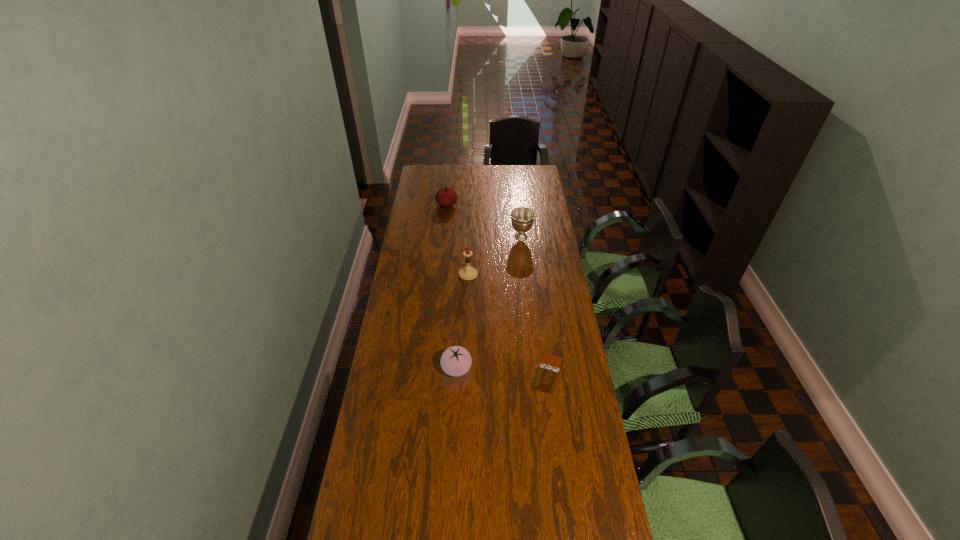
Locate an element on the screen. free space located 0.200m on the front of the chocolate bar is located at coordinates (558, 451).

Find the location of `object that is at the left edge`. object that is at the left edge is located at coordinates (446, 197).

This screenshot has width=960, height=540. In order to click on chalice that is at the right edge in this screenshot , I will do `click(522, 218)`.

What are the coordinates of `chocolate bar located at the right edge` in the screenshot? It's located at (548, 370).

I want to click on free space at the left edge of the desktop, so click(x=416, y=208).

This screenshot has width=960, height=540. In the image, there is a desktop. Identify the location of free space at the right edge. (540, 357).

Find the location of a particular element. empty space between the candle and the shortest object is located at coordinates (508, 323).

Locate an element on the screen. This screenshot has height=540, width=960. free area in between the candle and the fourth shortest object is located at coordinates (494, 255).

The width and height of the screenshot is (960, 540). Find the location of `free space between the second tallest object and the third farthest object`. free space between the second tallest object and the third farthest object is located at coordinates (494, 255).

This screenshot has height=540, width=960. I want to click on free space between the shortest object and the farther tomato, so click(x=497, y=289).